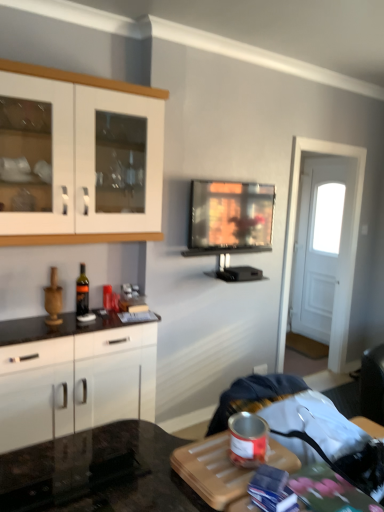
Question: Is white wooden door at right spatially inside white glossy cabinet at left, marked as the 2th cabinetry in a top-to-bottom arrangement, or outside of it?

Choices:
 (A) outside
 (B) inside

Answer: (A)

Question: Is point (307, 323) closer or farther from the camera than point (9, 448)?

Choices:
 (A) closer
 (B) farther

Answer: (B)

Question: Which of these objects is positioned farthest from the white wooden door at right?

Choices:
 (A) white glossy cabinet at upper left, marked as the 2th cabinetry in a bottom-to-top arrangement
 (B) flat screen tv at center
 (C) white glossy cabinet at left, marked as the 2th cabinetry in a top-to-bottom arrangement

Answer: (C)

Question: Estimate the real-world distances between objects in this image. Which object is closer to the flat screen tv at center?

Choices:
 (A) white glossy cabinet at left, which ranks as the 1th cabinetry in bottom-to-top order
 (B) white glossy cabinet at upper left, the first cabinetry positioned from the top
 (C) white wooden door at right

Answer: (B)